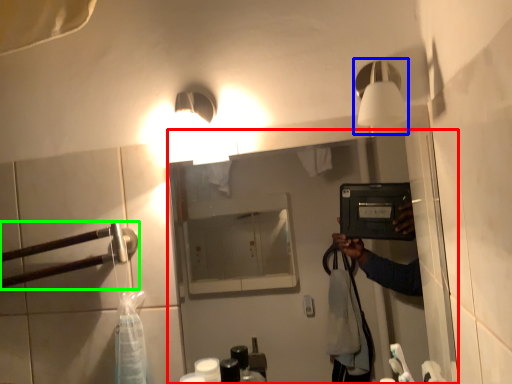
Question: Which object is positioned farthest from mirror (highlighted by a red box)? Select from light fixture (highlighted by a blue box) and door handle (highlighted by a green box).

Choices:
 (A) light fixture
 (B) door handle

Answer: (A)